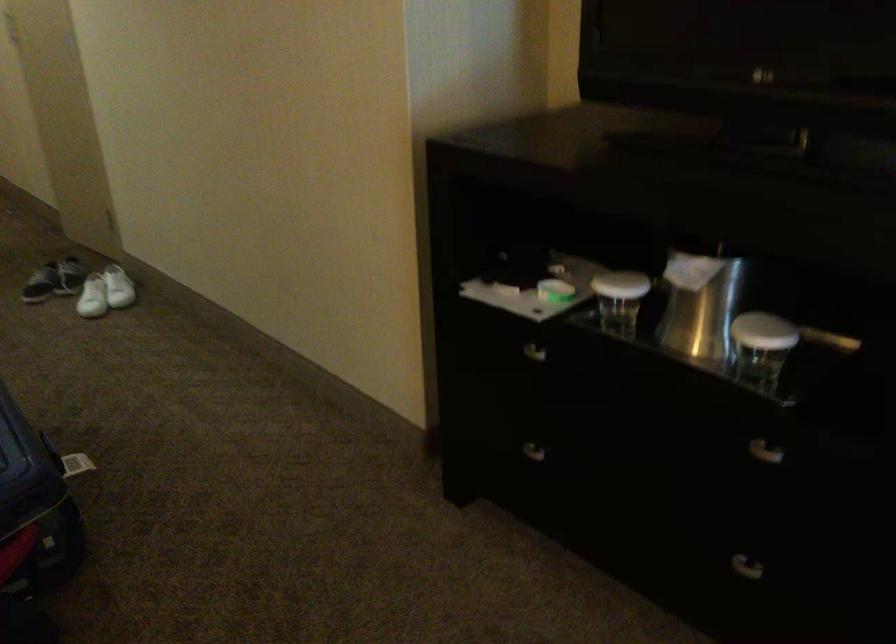
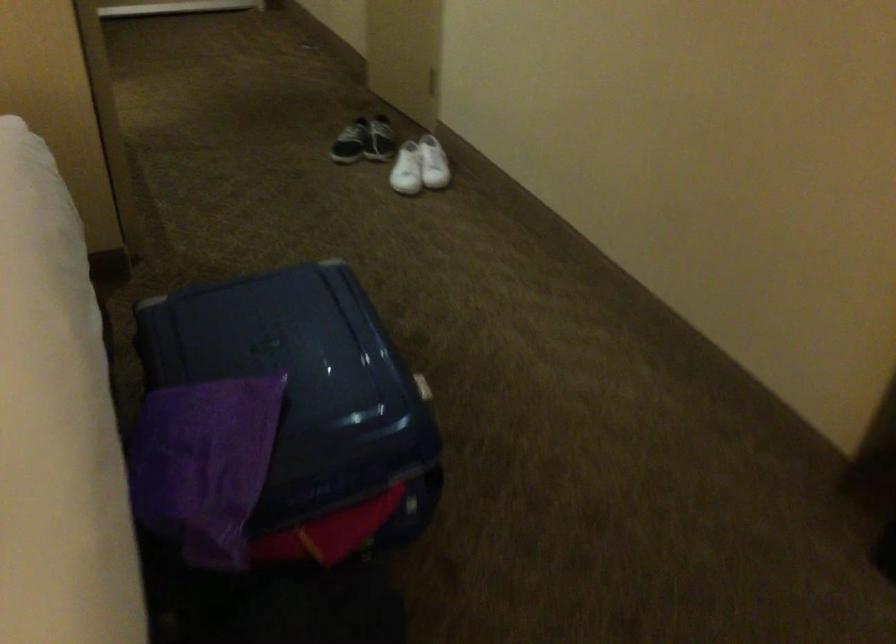
Which direction would the cameraman need to move to produce the second image?

The movement direction of the cameraman is left, forward.